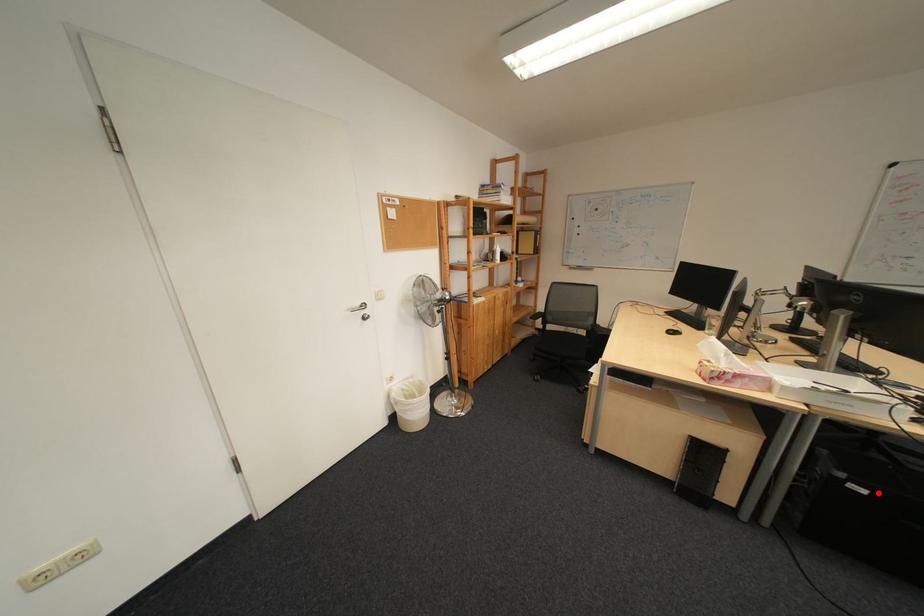
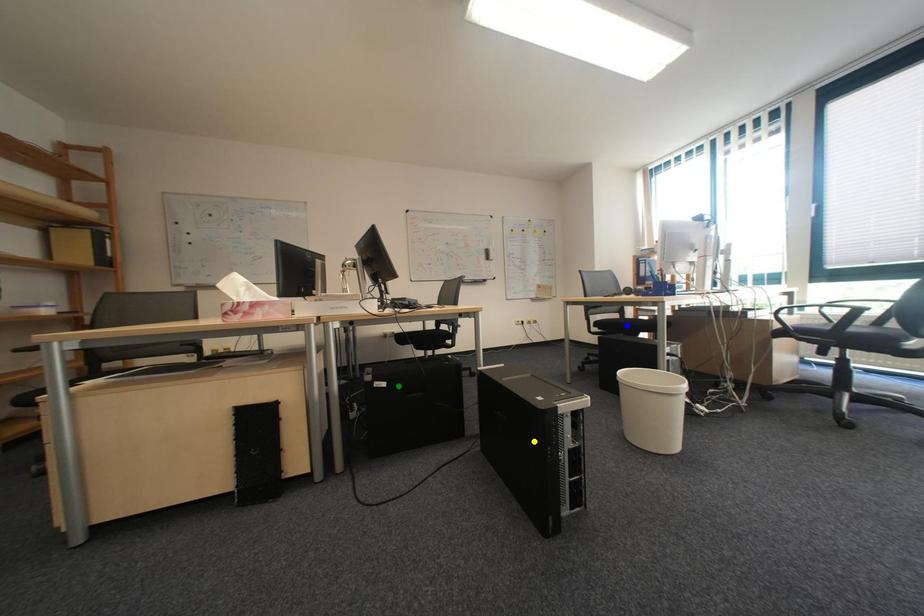
Question: I am providing you with two images of the same scene from different viewpoints. A red point is marked on the first image. You are given multiple points on the second image. Which point in image 2 represents the same 3d spot as the red point in image 1?

Choices:
 (A) blue point
 (B) yellow point
 (C) green point

Answer: (C)